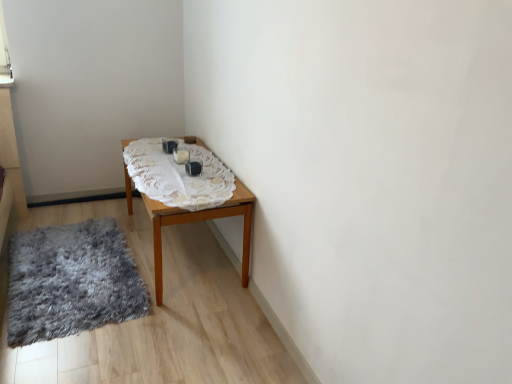
Question: Is shaggy gray rug at lower left in front of or behind white lace tablecloth at center in the image?

Choices:
 (A) behind
 (B) front

Answer: (B)

Question: In terms of height, does shaggy gray rug at lower left look taller or shorter compared to white lace tablecloth at center?

Choices:
 (A) tall
 (B) short

Answer: (A)

Question: Which is farther from the shaggy gray rug at lower left?

Choices:
 (A) wooden table at center
 (B) white lace tablecloth at center

Answer: (B)

Question: Which is farther from the shaggy gray rug at lower left?

Choices:
 (A) white lace tablecloth at center
 (B) wooden table at center

Answer: (A)